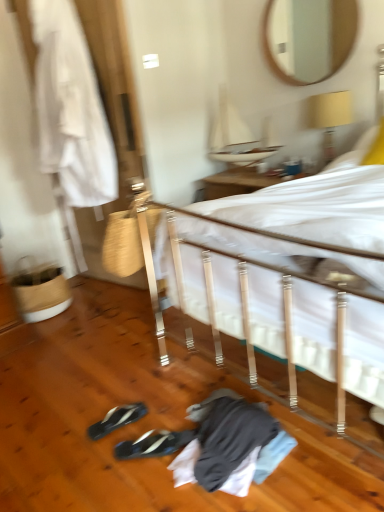
Question: Is white fabric bed at center further to camera compared to wooden mirror at upper center?

Choices:
 (A) yes
 (B) no

Answer: (B)

Question: From the image's perspective, would you say white fabric bed at center is shown under wooden mirror at upper center?

Choices:
 (A) no
 (B) yes

Answer: (B)

Question: Is white fabric bed at center to the right of wooden mirror at upper center from the viewer's perspective?

Choices:
 (A) no
 (B) yes

Answer: (A)

Question: Is white fabric bed at center smaller than wooden mirror at upper center?

Choices:
 (A) no
 (B) yes

Answer: (A)

Question: From a real-world perspective, is white fabric bed at center physically above wooden mirror at upper center?

Choices:
 (A) no
 (B) yes

Answer: (A)

Question: Would you say black synthetic sneakers at lower left, which appears as the 1th footwear when viewed from the back, is inside or outside yellow fabric lampshade at upper right?

Choices:
 (A) outside
 (B) inside

Answer: (A)

Question: From their relative heights in the image, would you say black synthetic sneakers at lower left, which appears as the 1th footwear when viewed from the back, is taller or shorter than yellow fabric lampshade at upper right?

Choices:
 (A) tall
 (B) short

Answer: (B)

Question: Is black synthetic sneakers at lower left, the second footwear viewed from the front, bigger or smaller than yellow fabric lampshade at upper right?

Choices:
 (A) small
 (B) big

Answer: (A)

Question: Visually, is black synthetic sneakers at lower left, which appears as the 1th footwear when viewed from the back, positioned to the left or to the right of yellow fabric lampshade at upper right?

Choices:
 (A) left
 (B) right

Answer: (A)

Question: In terms of width, does black synthetic sneakers at lower center, the second footwear in the back-to-front sequence, look wider or thinner when compared to black synthetic sneakers at lower left, the second footwear viewed from the front?

Choices:
 (A) thin
 (B) wide

Answer: (B)

Question: Considering their positions, is black synthetic sneakers at lower center, the second footwear in the back-to-front sequence, located in front of or behind black synthetic sneakers at lower left, the second footwear viewed from the front?

Choices:
 (A) behind
 (B) front

Answer: (B)

Question: From a real-world perspective, is black synthetic sneakers at lower center, arranged as the 1th footwear when viewed from the front, physically located above or below black synthetic sneakers at lower left, the second footwear viewed from the front?

Choices:
 (A) above
 (B) below

Answer: (B)

Question: From the image's perspective, is black synthetic sneakers at lower center, the second footwear in the back-to-front sequence, positioned above or below black synthetic sneakers at lower left, which appears as the 1th footwear when viewed from the back?

Choices:
 (A) above
 (B) below

Answer: (B)

Question: Based on their positions, is black synthetic sneakers at lower left, the second footwear viewed from the front, located to the left or right of white fabric at left?

Choices:
 (A) left
 (B) right

Answer: (B)

Question: Considering their positions, is black synthetic sneakers at lower left, which appears as the 1th footwear when viewed from the back, located in front of or behind white fabric at left?

Choices:
 (A) behind
 (B) front

Answer: (B)